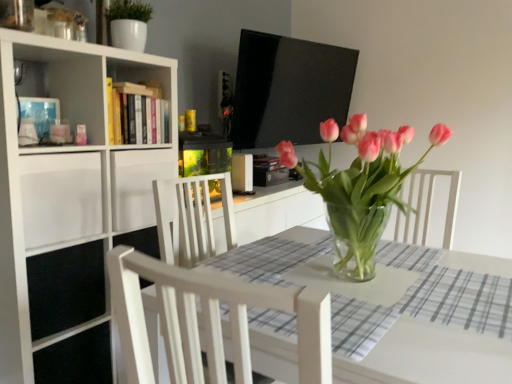
This screenshot has width=512, height=384. What are the coordinates of `empty space that is ontop of clear glass table at center` in the screenshot? It's located at (391, 298).